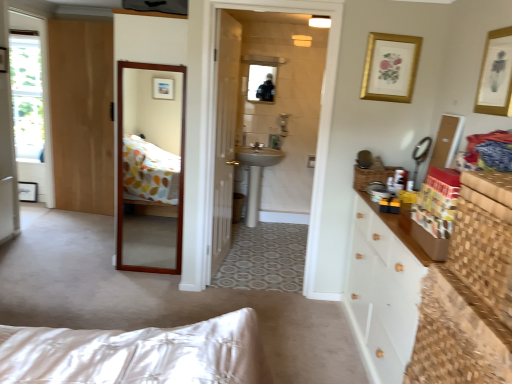
Locate an element on the screen. free space above light brown wood door at left, the 1th door when ordered from back to front (from a real-world perspective) is located at coordinates [x=70, y=22].